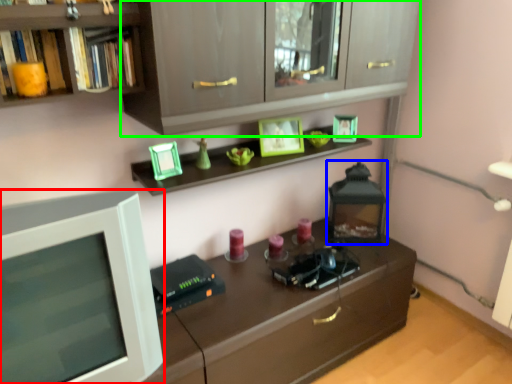
Question: Which object is positioned closest to computer monitor (highlighted by a red box)? Select from appliance (highlighted by a blue box) and cabinetry (highlighted by a green box).

Choices:
 (A) appliance
 (B) cabinetry

Answer: (B)